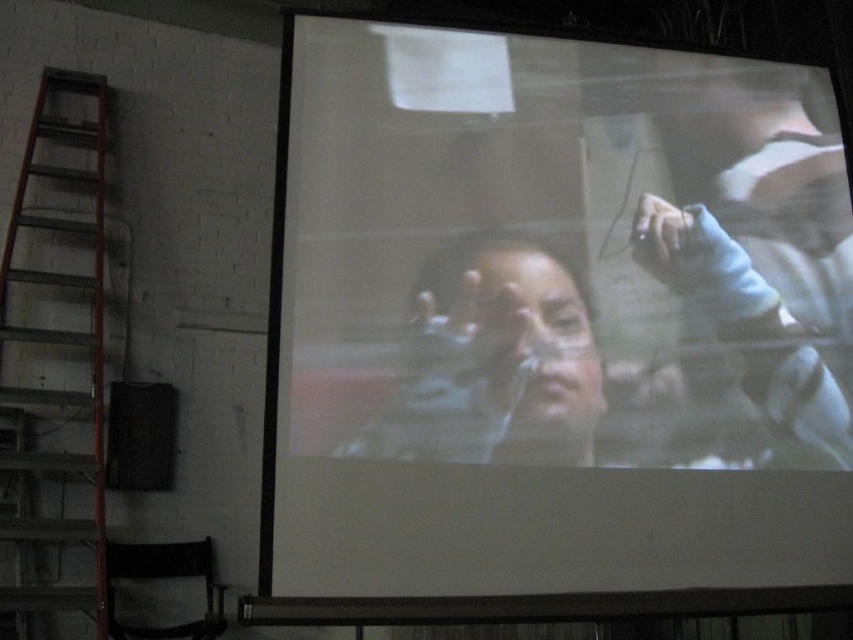
Can you confirm if smooth skin face at center is thinner than metallic orange ladder at left?

No.

Image resolution: width=853 pixels, height=640 pixels. I want to click on smooth skin face at center, so click(x=497, y=365).

Is white matte projection screen at center smaller than metallic orange ladder at left?

Incorrect, white matte projection screen at center is not smaller in size than metallic orange ladder at left.

Is point (263, 524) closer to camera compared to point (64, 518)?

Yes, it is in front of point (64, 518).

Identify the location of white matte projection screen at center. (548, 321).

From the picture: Does white matte projection screen at center have a smaller size compared to smooth skin face at center?

No, white matte projection screen at center is not smaller than smooth skin face at center.

Does white matte projection screen at center have a larger size compared to smooth skin face at center?

Indeed, white matte projection screen at center has a larger size compared to smooth skin face at center.

What do you see at coordinates (548, 321) in the screenshot? The image size is (853, 640). I see `white matte projection screen at center` at bounding box center [548, 321].

I want to click on white matte projection screen at center, so click(548, 321).